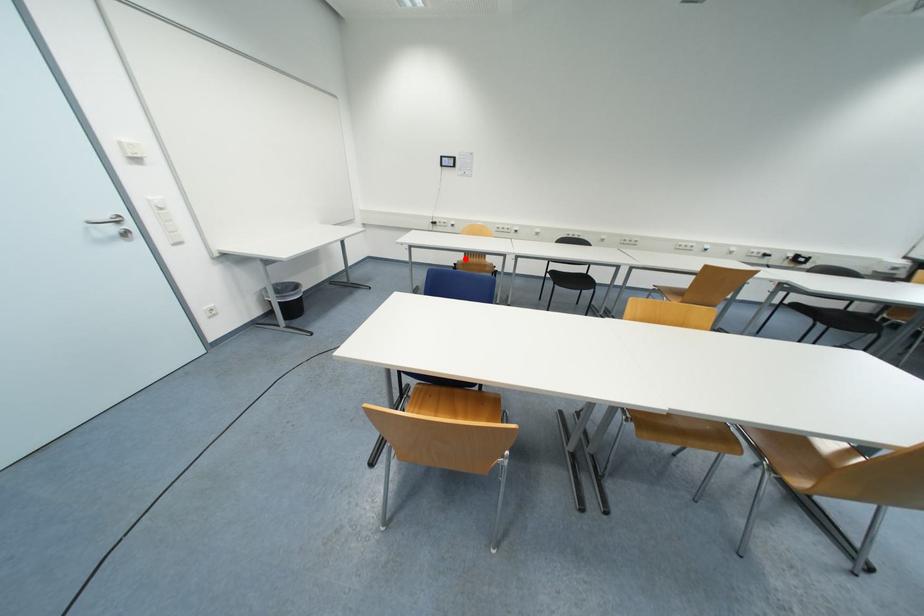
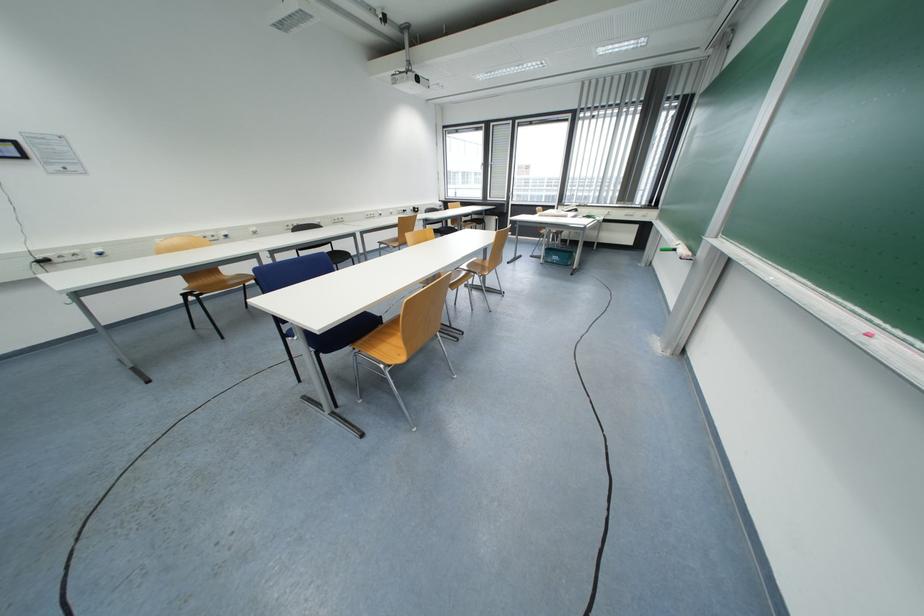
In the second image, find the point that corresponds to the highlighted location in the first image.

(186, 286)